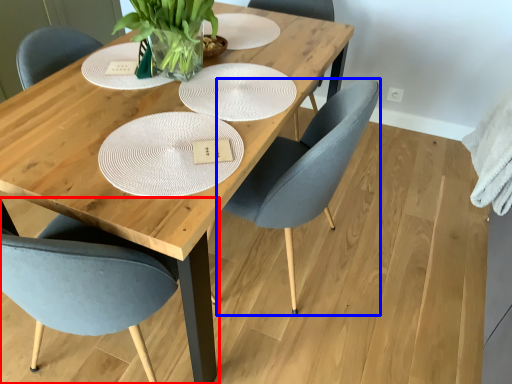
Question: Among these objects, which one is nearest to the camera, chair (highlighted by a red box) or chair (highlighted by a blue box)?

Choices:
 (A) chair
 (B) chair

Answer: (A)